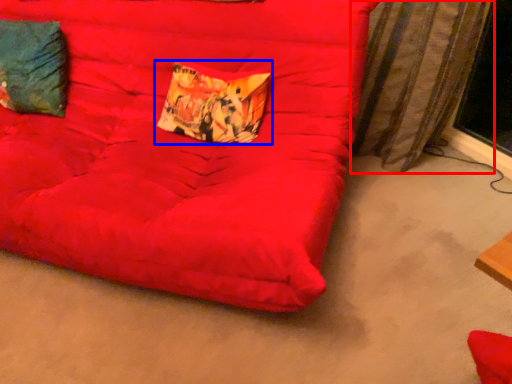
Question: Which object appears farthest to the camera in this image, curtain (highlighted by a red box) or pillow (highlighted by a blue box)?

Choices:
 (A) curtain
 (B) pillow

Answer: (B)